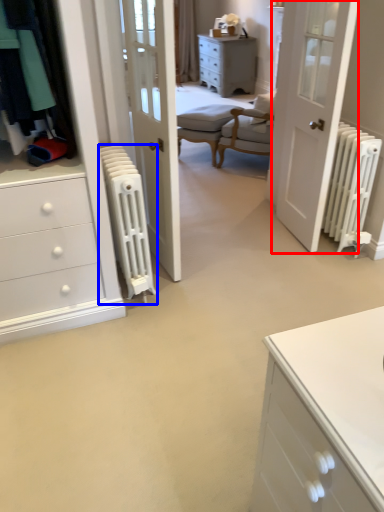
Question: Which point is further to the camera, door (highlighted by a red box) or radiator (highlighted by a blue box)?

Choices:
 (A) door
 (B) radiator

Answer: (A)